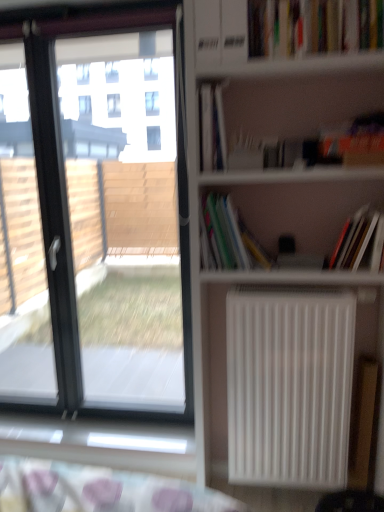
Question: Can you confirm if hardcover book at right, which appears as the fourth book when viewed from the top, is bigger than white matte radiator at center right?

Choices:
 (A) yes
 (B) no

Answer: (B)

Question: Is there a large distance between hardcover book at right, which appears as the fourth book when viewed from the top, and white matte radiator at center right?

Choices:
 (A) no
 (B) yes

Answer: (A)

Question: From the image's perspective, is hardcover book at right, which appears as the fourth book when viewed from the top, on top of white matte radiator at center right?

Choices:
 (A) no
 (B) yes

Answer: (B)

Question: Can you confirm if hardcover book at right, the first book in the bottom-to-top sequence, is smaller than white matte radiator at center right?

Choices:
 (A) no
 (B) yes

Answer: (B)

Question: Is hardcover book at right, the first book in the bottom-to-top sequence, outside of white matte radiator at center right?

Choices:
 (A) no
 (B) yes

Answer: (B)

Question: From the image's perspective, is transparent glass window at left located above or below multicolored paper at center, which is the 3th book in top-to-bottom order?

Choices:
 (A) above
 (B) below

Answer: (B)

Question: Looking at the image, does transparent glass window at left seem bigger or smaller compared to multicolored paper at center, which is the 2th book in bottom-to-top order?

Choices:
 (A) small
 (B) big

Answer: (B)

Question: Would you say transparent glass window at left is to the left or to the right of multicolored paper at center, which is the 3th book in top-to-bottom order, in the picture?

Choices:
 (A) right
 (B) left

Answer: (B)

Question: Is transparent glass window at left inside or outside of multicolored paper at center, which is the 3th book in top-to-bottom order?

Choices:
 (A) outside
 (B) inside

Answer: (A)

Question: Does point (269, 2) appear closer or farther from the camera than point (231, 371)?

Choices:
 (A) farther
 (B) closer

Answer: (B)

Question: Considering the positions of hardcover book at upper right, which is the 1th book from top to bottom, and white matte radiator at center right in the image, is hardcover book at upper right, which is the 1th book from top to bottom, wider or thinner than white matte radiator at center right?

Choices:
 (A) wide
 (B) thin

Answer: (B)

Question: From a real-world perspective, is hardcover book at upper right, which is the 1th book from top to bottom, positioned above or below white matte radiator at center right?

Choices:
 (A) below
 (B) above

Answer: (B)

Question: Considering their positions, is hardcover book at upper right, the 4th book in the bottom-to-top sequence, located in front of or behind white matte radiator at center right?

Choices:
 (A) front
 (B) behind

Answer: (A)

Question: From a real-world perspective, is white matte radiator at center right above or below hardcover book at upper center, which ranks as the second book in top-to-bottom order?

Choices:
 (A) below
 (B) above

Answer: (A)

Question: Based on their sizes in the image, would you say white matte radiator at center right is bigger or smaller than hardcover book at upper center, marked as the 3th book in a bottom-to-top arrangement?

Choices:
 (A) small
 (B) big

Answer: (B)